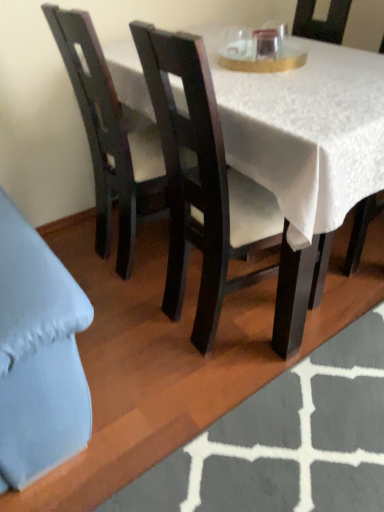
Image resolution: width=384 pixels, height=512 pixels. I want to click on free area in between matte dark wood chair at center, which is the 2th chair in left-to-right order, and white textured rug at lower center, so click(161, 396).